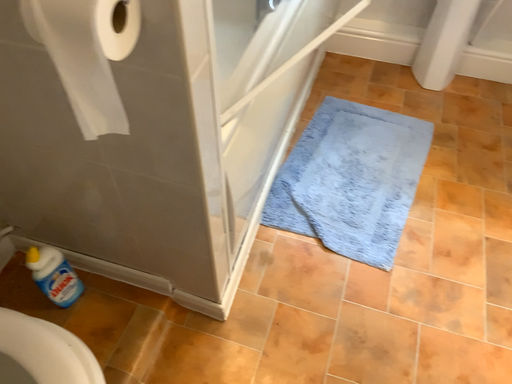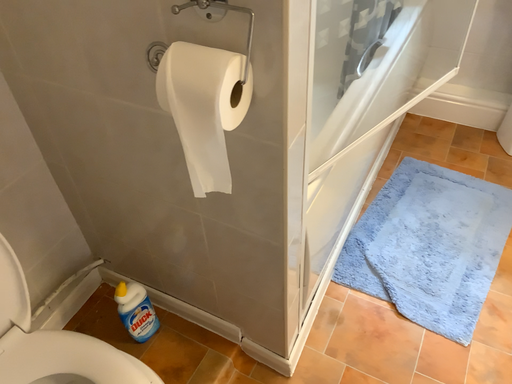
Question: Which way did the camera rotate in the video?

Choices:
 (A) rotated right
 (B) rotated left

Answer: (B)